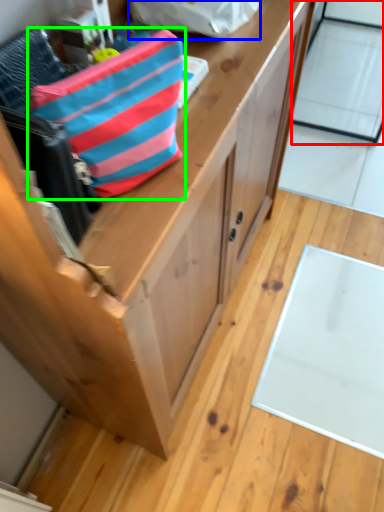
Question: Which object is the closest to the glass door (highlighted by a red box)? Choose among these: pouch (highlighted by a blue box) or pouch (highlighted by a green box).

Choices:
 (A) pouch
 (B) pouch

Answer: (A)